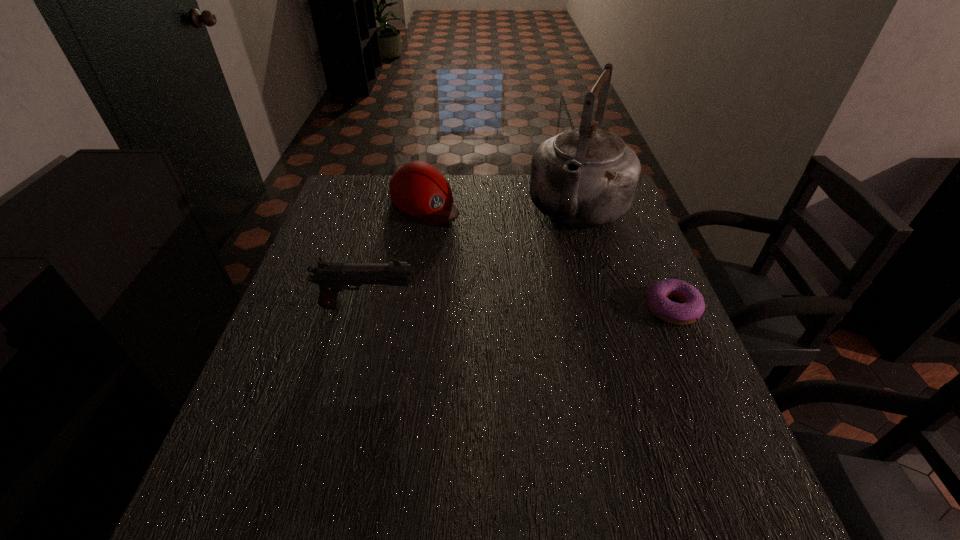
You are a GUI agent. You are given a task and a screenshot of the screen. Output one action in this format:
    pyautogui.click(x=<x>, y=<y>)
    Task: Click on the gun
    The width and height of the screenshot is (960, 540).
    Given the screenshot: What is the action you would take?
    pyautogui.click(x=332, y=277)

This screenshot has height=540, width=960. I want to click on doughnut, so click(692, 306).

Image resolution: width=960 pixels, height=540 pixels. I want to click on baseball cap, so click(418, 189).

Find the location of a particular element. kettle is located at coordinates (586, 176).

The image size is (960, 540). Find the location of `free space located in the direction the gun is aimed`. free space located in the direction the gun is aimed is located at coordinates (492, 306).

Where is `free space located on the left of the doughnut`? free space located on the left of the doughnut is located at coordinates (607, 307).

The width and height of the screenshot is (960, 540). Identify the location of vacant space located on the front-facing side of the third tallest object. (512, 287).

I want to click on vacant space located on the front-facing side of the third tallest object, so click(480, 256).

The height and width of the screenshot is (540, 960). Identify the location of free spot located on the front-facing side of the third tallest object. (497, 273).

Where is `vacant space located 0.210m at the spout of the kettle`? Image resolution: width=960 pixels, height=540 pixels. vacant space located 0.210m at the spout of the kettle is located at coordinates (547, 294).